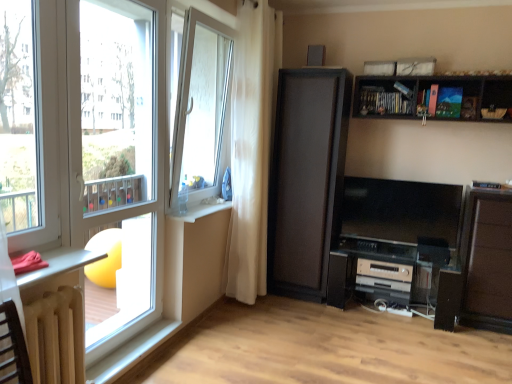
Where is `unoccupied area in front of silver metallic stereo at lower center, which ranks as the first appliance in bottom-to-top order`? The image size is (512, 384). unoccupied area in front of silver metallic stereo at lower center, which ranks as the first appliance in bottom-to-top order is located at coordinates (409, 348).